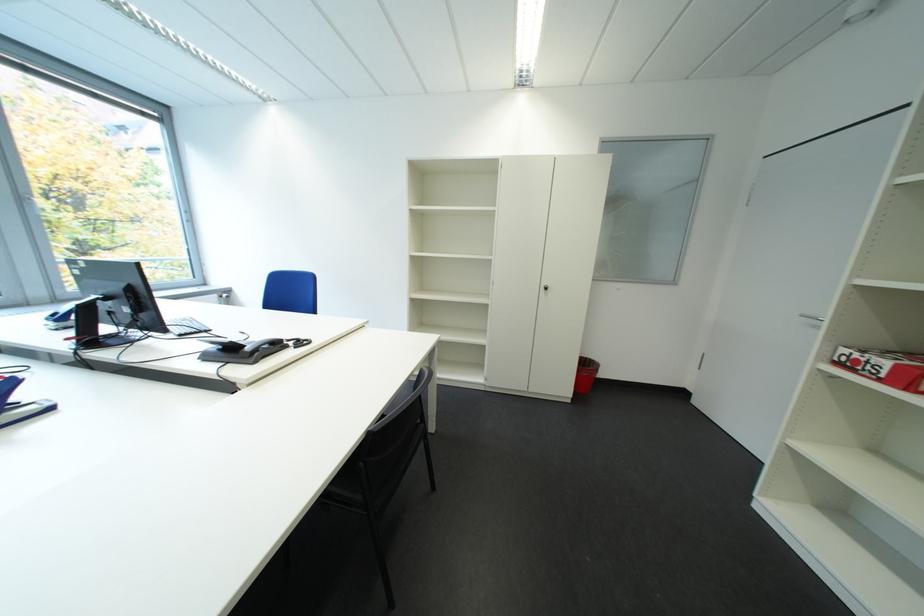
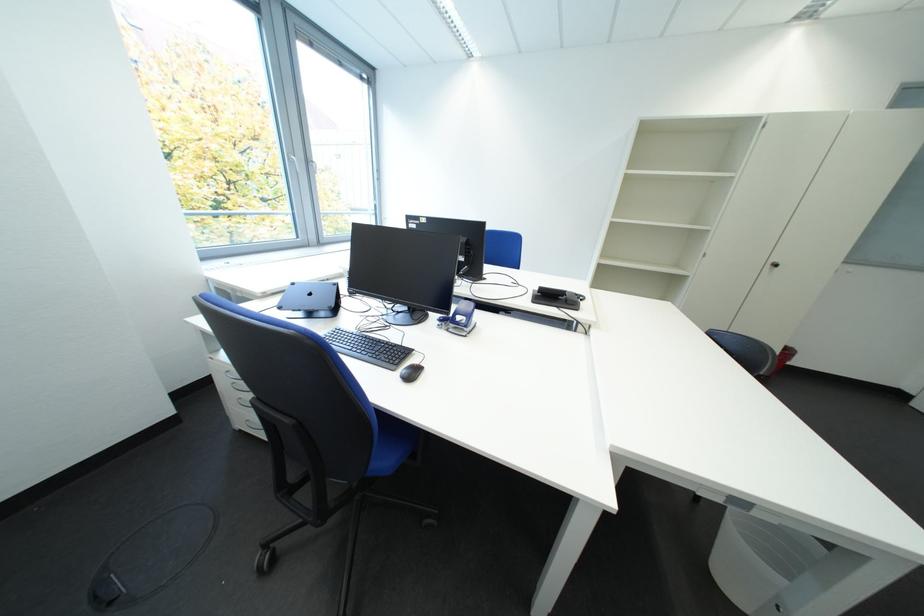
Question: The images are taken continuously from a first-person perspective. In which direction are you moving?

Choices:
 (A) Left
 (B) Right
 (C) Forward
 (D) Backward

Answer: (A)